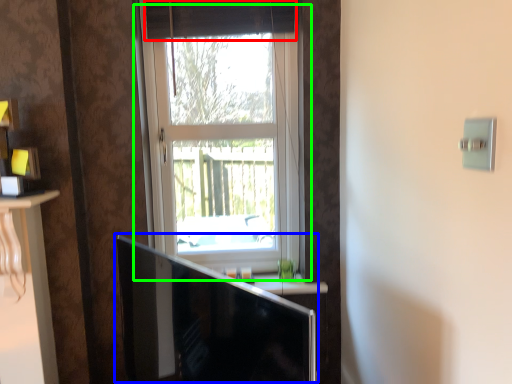
Question: Estimate the real-world distances between objects in this image. Which object is farther from curtain (highlighted by a red box), computer monitor (highlighted by a blue box) or window (highlighted by a green box)?

Choices:
 (A) computer monitor
 (B) window

Answer: (A)